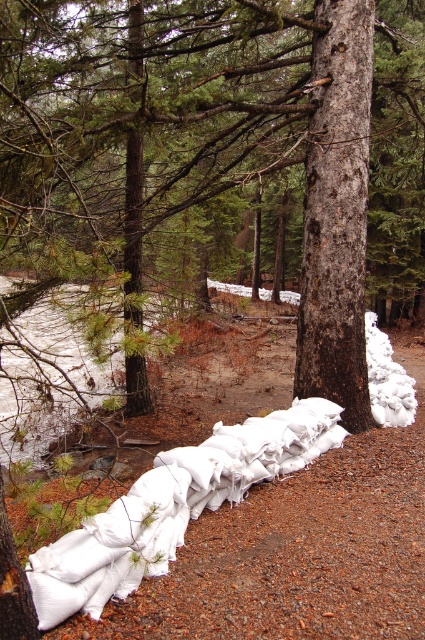
Question: Which point appears farthest from the camera in this image?

Choices:
 (A) (150, 554)
 (B) (362, 419)

Answer: (B)

Question: Which object appears farthest from the camera in this image?

Choices:
 (A) brown rough tree at center
 (B) smooth brown bark at center

Answer: (B)

Question: In this image, where is smooth brown bark at center located relative to white fabric sandbags at lower center?

Choices:
 (A) left
 (B) right

Answer: (B)

Question: Is smooth brown bark at center wider than white fabric sandbags at lower center?

Choices:
 (A) no
 (B) yes

Answer: (A)

Question: Among these points, which one is farthest from the camera?

Choices:
 (A) click(x=107, y=580)
 (B) click(x=93, y=3)

Answer: (B)

Question: Is brown rough tree at center positioned behind white fabric sandbags at lower center?

Choices:
 (A) yes
 (B) no

Answer: (B)